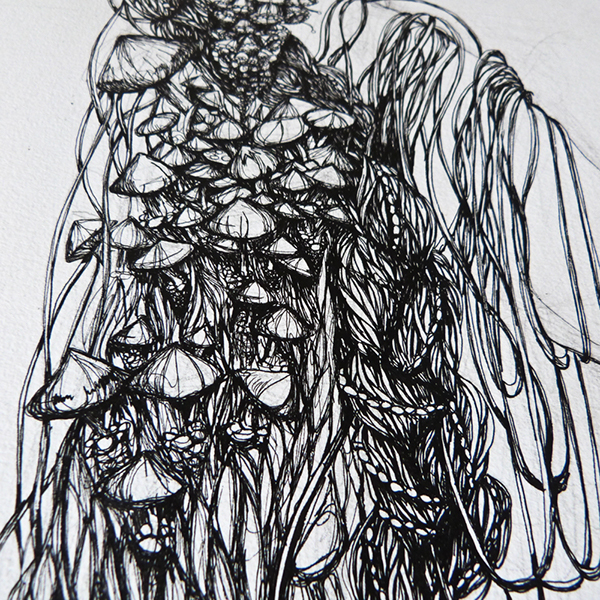
Where is `blank paper`? Image resolution: width=600 pixels, height=600 pixels. blank paper is located at coordinates (31, 111).